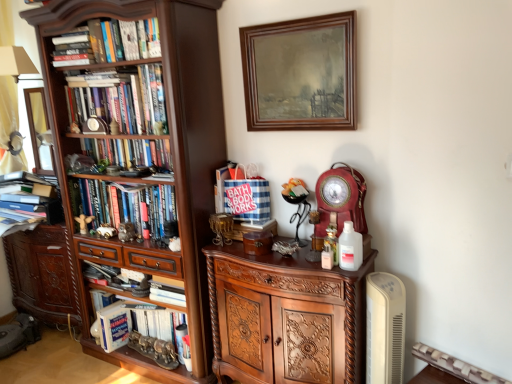
Question: Is hardcover books at left, the 2th book when ordered from top to bottom, smaller than wooden picture frame at upper center?

Choices:
 (A) no
 (B) yes

Answer: (A)

Question: From a real-world perspective, is hardcover books at left, the 4th book from the bottom, located beneath wooden picture frame at upper center?

Choices:
 (A) yes
 (B) no

Answer: (A)

Question: From the image's perspective, is hardcover books at left, the 4th book from the bottom, under wooden picture frame at upper center?

Choices:
 (A) no
 (B) yes

Answer: (B)

Question: Considering the relative sizes of hardcover books at left, the 2th book when ordered from top to bottom, and wooden picture frame at upper center in the image provided, is hardcover books at left, the 2th book when ordered from top to bottom, thinner than wooden picture frame at upper center?

Choices:
 (A) yes
 (B) no

Answer: (B)

Question: Is hardcover books at left, the 2th book when ordered from top to bottom, next to wooden picture frame at upper center?

Choices:
 (A) yes
 (B) no

Answer: (B)

Question: From their relative heights in the image, would you say hardcover book at lower left, which is counted as the first book, starting from the bottom, is taller or shorter than hardcover books at left, the 2th book when ordered from top to bottom?

Choices:
 (A) short
 (B) tall

Answer: (B)

Question: Looking at their shapes, would you say hardcover book at lower left, which is counted as the first book, starting from the bottom, is wider or thinner than hardcover books at left, the 2th book when ordered from top to bottom?

Choices:
 (A) thin
 (B) wide

Answer: (B)

Question: Choose the correct answer: Is hardcover book at lower left, which is counted as the first book, starting from the bottom, inside hardcover books at left, the 4th book from the bottom, or outside it?

Choices:
 (A) inside
 (B) outside

Answer: (B)

Question: From a real-world perspective, is hardcover book at lower left, the 5th book from the top, physically located above or below hardcover books at left, the 4th book from the bottom?

Choices:
 (A) below
 (B) above

Answer: (A)

Question: Is metallic silver radiator at lower right to the left or to the right of polished wood cabinet at center, acting as the 1th cabinetry starting from the front, in the image?

Choices:
 (A) left
 (B) right

Answer: (B)

Question: Is metallic silver radiator at lower right taller or shorter than polished wood cabinet at center, the 1th cabinetry from the right?

Choices:
 (A) tall
 (B) short

Answer: (B)

Question: From the image's perspective, relative to polished wood cabinet at center, the 1th cabinetry from the right, is metallic silver radiator at lower right above or below?

Choices:
 (A) above
 (B) below

Answer: (B)

Question: Is point (415, 349) closer or farther from the camera than point (256, 342)?

Choices:
 (A) closer
 (B) farther

Answer: (A)

Question: Looking at their shapes, would you say matte red clock at center-right is wider or thinner than hardcover books at center, the 1th book viewed from the top?

Choices:
 (A) thin
 (B) wide

Answer: (A)

Question: In the image, is matte red clock at center-right on the left side or the right side of hardcover books at center, the 1th book viewed from the top?

Choices:
 (A) left
 (B) right

Answer: (B)